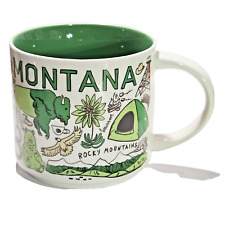
Identify the location of coffee cup. The height and width of the screenshot is (225, 225). (75, 96).